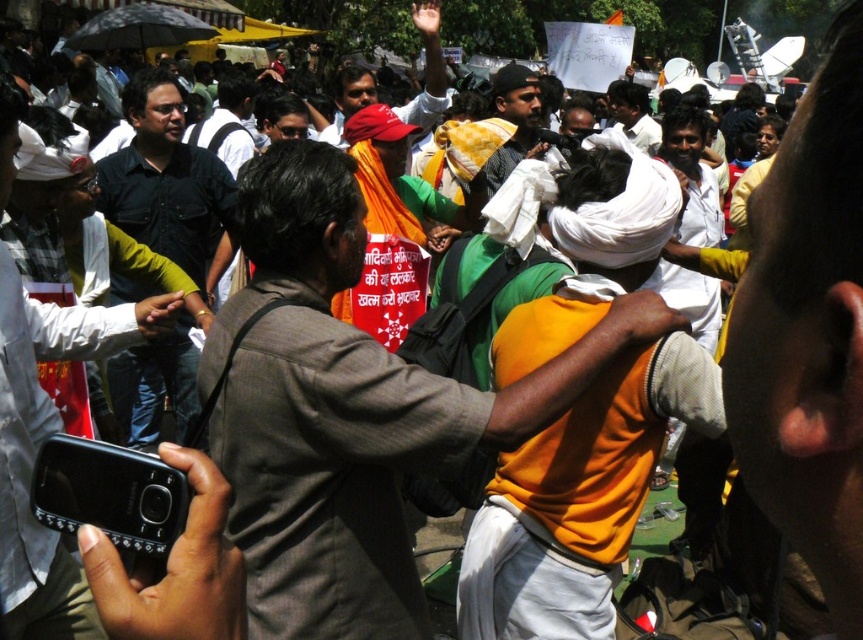
You are part of the crowd in the image and want to take a photo of both the dark blue shirt at center and the orange fabric cloth at center. Which object should you focus on first to ensure both are in the frame?

You should focus on the orange fabric cloth at center first because it is larger in size compared to the dark blue shirt at center, ensuring it fits within the frame before adjusting for the smaller object.

You are standing in the crowd and want to take a photo of the central figure wearing a green shirt and white turban. There is a person in front of you holding a Samsung phone and focusing on the central figure. Do you think the person with the matte black shirt at left represented by point (x=39, y=442) is blocking your view of the central figure?

The matte black shirt at left represented by point (x=39, y=442) is located at the lower left corner of the image, so it is unlikely to block your view of the central figure who is in the center of the image.

You are standing in the crowd and want to take a photo of both the person holding the Samsung mobile phone and the central figure in the green shirt and white turban. Which of the two points, point (187, 374) or point (505, 93), is closer to you?

Point (187, 374) is closer to the camera than point (505, 93), so it is closer to you.